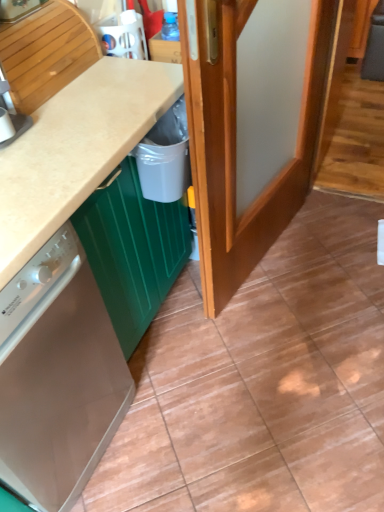
Question: Should I look upward or downward to see white plastic bin at lower center?

Choices:
 (A) up
 (B) down

Answer: (A)

Question: Is wooden door at center turned away from satin white dishwasher at lower left?

Choices:
 (A) yes
 (B) no

Answer: (B)

Question: Can you confirm if wooden door at center is wider than satin white dishwasher at lower left?

Choices:
 (A) yes
 (B) no

Answer: (B)

Question: Is wooden door at center next to satin white dishwasher at lower left?

Choices:
 (A) yes
 (B) no

Answer: (B)

Question: Is wooden door at center to the right of satin white dishwasher at lower left from the viewer's perspective?

Choices:
 (A) no
 (B) yes

Answer: (B)

Question: Is wooden door at center at the left side of satin white dishwasher at lower left?

Choices:
 (A) no
 (B) yes

Answer: (A)

Question: Can you confirm if wooden door at center is taller than satin white dishwasher at lower left?

Choices:
 (A) no
 (B) yes

Answer: (B)

Question: Considering the relative sizes of white plastic bin at lower center and satin white dishwasher at lower left in the image provided, is white plastic bin at lower center taller than satin white dishwasher at lower left?

Choices:
 (A) no
 (B) yes

Answer: (A)

Question: Is white plastic bin at lower center further to the viewer compared to satin white dishwasher at lower left?

Choices:
 (A) no
 (B) yes

Answer: (B)

Question: Is satin white dishwasher at lower left completely or partially inside white plastic bin at lower center?

Choices:
 (A) no
 (B) yes

Answer: (A)

Question: Is white plastic bin at lower center looking in the opposite direction of satin white dishwasher at lower left?

Choices:
 (A) yes
 (B) no

Answer: (B)

Question: Can we say white plastic bin at lower center lies outside satin white dishwasher at lower left?

Choices:
 (A) yes
 (B) no

Answer: (A)

Question: From the image's perspective, is white plastic bin at lower center under satin white dishwasher at lower left?

Choices:
 (A) no
 (B) yes

Answer: (A)

Question: From the image's perspective, is satin white dishwasher at lower left on wooden door at center?

Choices:
 (A) yes
 (B) no

Answer: (B)